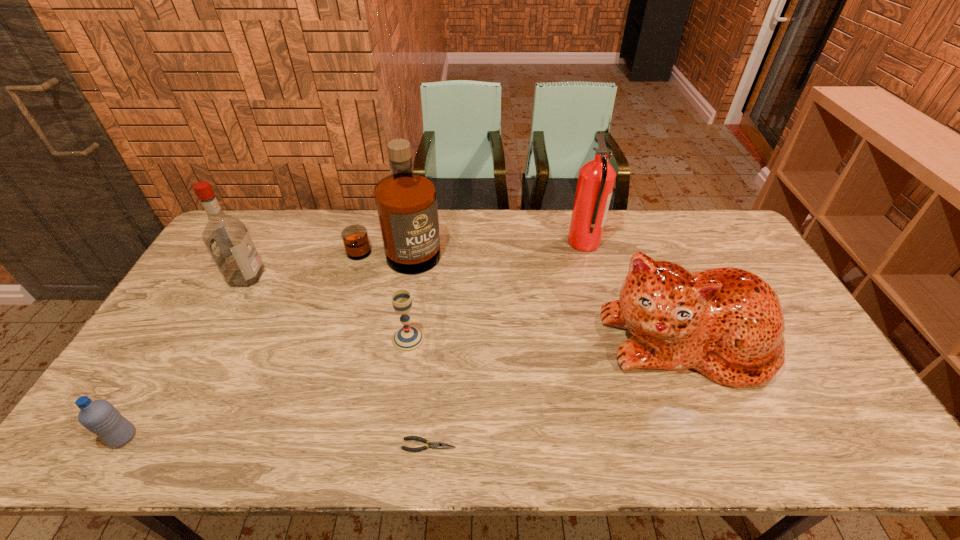
I want to click on vacant space located 0.070m at the nozzle of the fire extinguisher, so click(548, 242).

The width and height of the screenshot is (960, 540). In order to click on free spot located at the nozzle of the fire extinguisher in this screenshot , I will do tap(497, 242).

The height and width of the screenshot is (540, 960). Identify the location of vacant space positioned 0.240m on the front-facing side of the left liquor. (336, 277).

Find the location of a particular element. The width and height of the screenshot is (960, 540). vacant space located 0.130m on the face of the cat is located at coordinates (727, 440).

I want to click on blank space located on the back of the chalice, so click(413, 308).

At what (x,y) coordinates should I click in order to perform the action: click on vacant space located 0.090m on the back of the leftmost object. Please return your answer as a coordinate pair (x, y). The width and height of the screenshot is (960, 540). Looking at the image, I should click on (150, 392).

Find the location of a particular element. This screenshot has width=960, height=540. free space located 0.310m on the back of the shortest object is located at coordinates (439, 334).

Find the location of a particular element. Image resolution: width=960 pixels, height=540 pixels. liquor that is at the far edge is located at coordinates pos(406,202).

Locate an element on the screen. fire extinguisher positioned at the far edge is located at coordinates (596, 179).

I want to click on water bottle at the near edge, so click(100, 417).